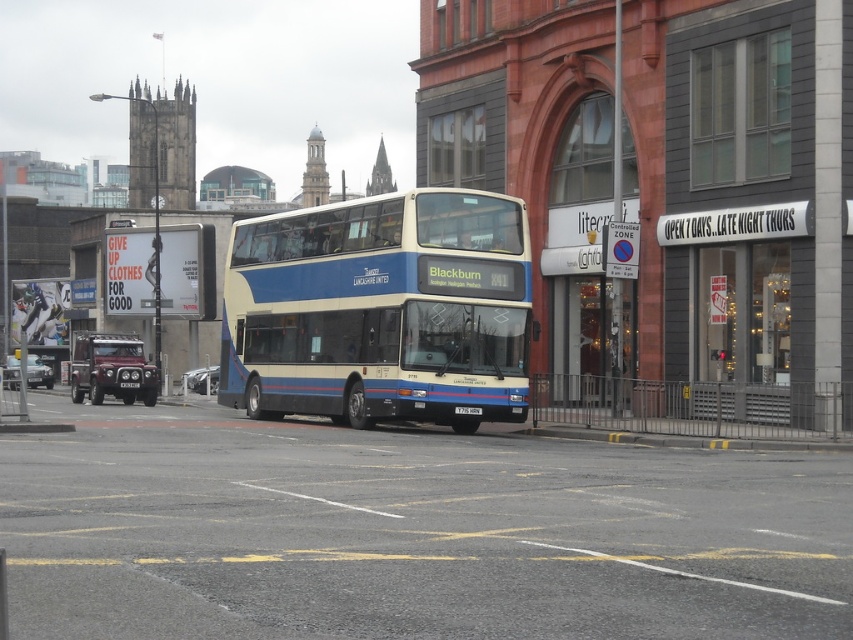
Is blue metallic bus at center positioned behind metallic silver car at center?

No, blue metallic bus at center is in front of metallic silver car at center.

Is blue metallic bus at center smaller than metallic silver car at center?

Actually, blue metallic bus at center might be larger than metallic silver car at center.

Does point (529, 250) lie in front of point (195, 390)?

Yes, point (529, 250) is in front of point (195, 390).

Locate an element on the screen. blue metallic bus at center is located at coordinates (380, 310).

Is blue metallic bus at center positioned before black plastic license plate at center?

Yes, it is in front of black plastic license plate at center.

Between point (354, 308) and point (456, 410), which one is positioned behind?

The point (354, 308) is more distant.

Locate an element on the screen. blue metallic bus at center is located at coordinates (380, 310).

Between maroon metallic suv at left and metallic silver car at lower left, which one appears on the left side from the viewer's perspective?

Positioned to the left is metallic silver car at lower left.

Which is in front, point (148, 394) or point (44, 365)?

Point (148, 394) is in front.

Image resolution: width=853 pixels, height=640 pixels. I want to click on maroon metallic suv at left, so click(111, 369).